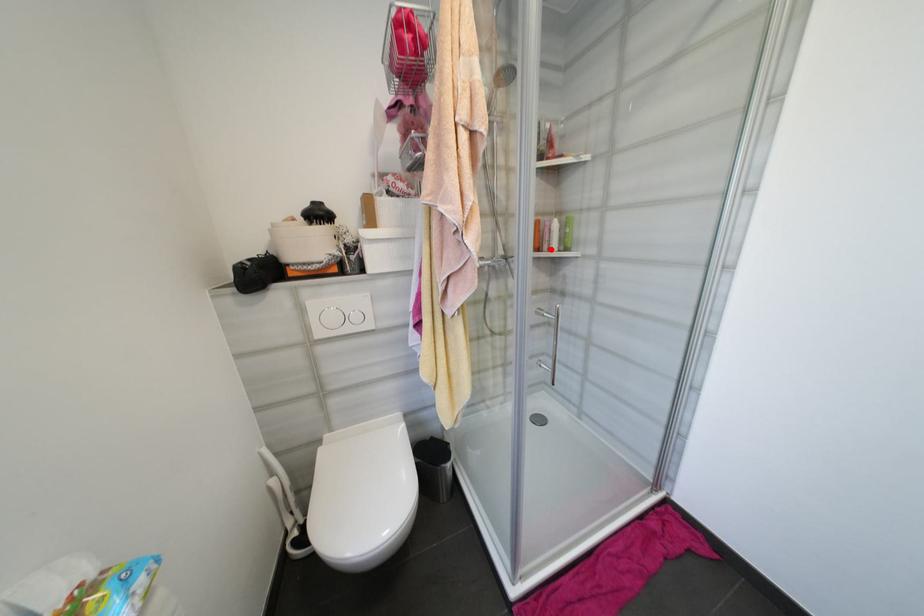
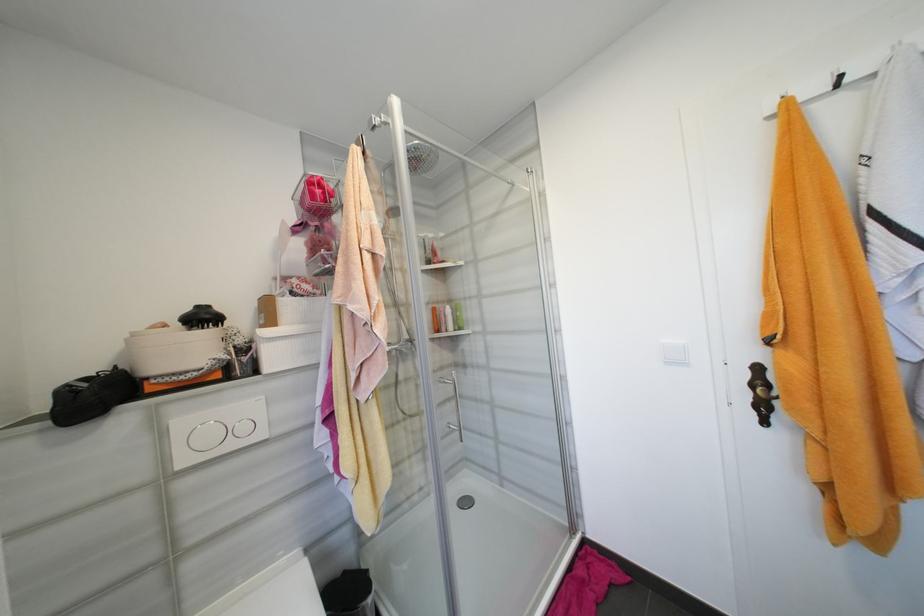
Where in the second image is the point corresponding to the highlighted location from the first image?

(450, 330)